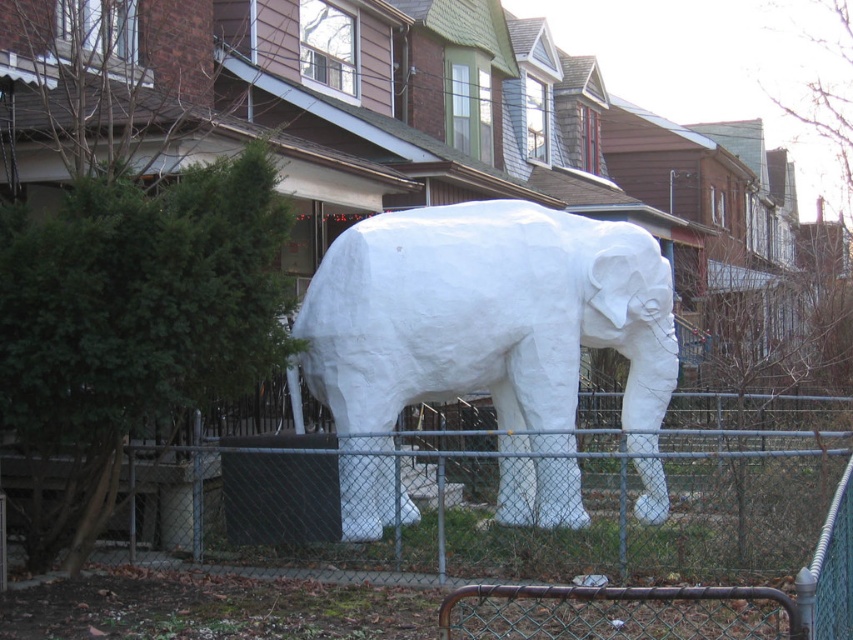
Question: Can you confirm if metal chain-link fence at center is thinner than white paper-like elephant at center?

Choices:
 (A) yes
 (B) no

Answer: (A)

Question: Does metal chain-link fence at center have a greater width compared to white paper-like elephant at center?

Choices:
 (A) yes
 (B) no

Answer: (B)

Question: Among these points, which one is farthest from the camera?

Choices:
 (A) click(x=492, y=540)
 (B) click(x=361, y=221)

Answer: (B)

Question: Is metal chain-link fence at center to the right of white paper-like elephant at center from the viewer's perspective?

Choices:
 (A) no
 (B) yes

Answer: (B)